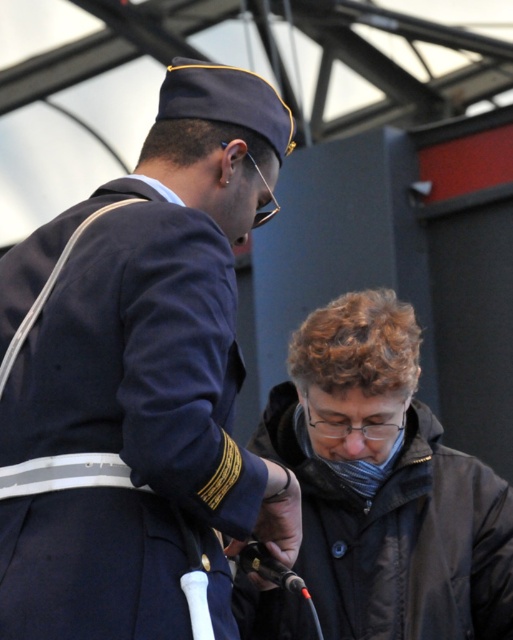
Question: Which of the following is the farthest from the observer?

Choices:
 (A) (165, 484)
 (B) (442, 561)

Answer: (B)

Question: From the image, what is the correct spatial relationship of navy blue uniform at upper left in relation to black matte jacket at lower right?

Choices:
 (A) above
 (B) below

Answer: (A)

Question: Which object is closer to the camera taking this photo?

Choices:
 (A) black matte jacket at lower right
 (B) navy blue uniform at upper left

Answer: (B)

Question: Can you confirm if navy blue uniform at upper left is positioned below black matte jacket at lower right?

Choices:
 (A) no
 (B) yes

Answer: (A)

Question: Considering the relative positions of navy blue uniform at upper left and black matte jacket at lower right in the image provided, where is navy blue uniform at upper left located with respect to black matte jacket at lower right?

Choices:
 (A) above
 (B) below

Answer: (A)